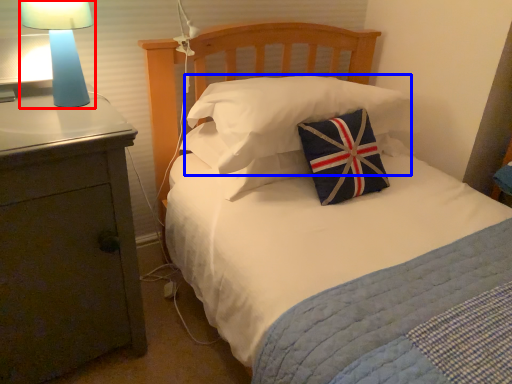
Question: Among these objects, which one is farthest to the camera, lamp (highlighted by a red box) or pillow (highlighted by a blue box)?

Choices:
 (A) lamp
 (B) pillow

Answer: (B)